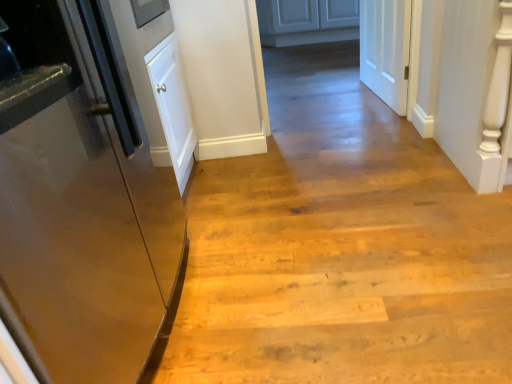
Locate an element on the screen. The image size is (512, 384). vacant region under white matte door at upper right, arranged as the second door when viewed from the front (from a real-world perspective) is located at coordinates (377, 97).